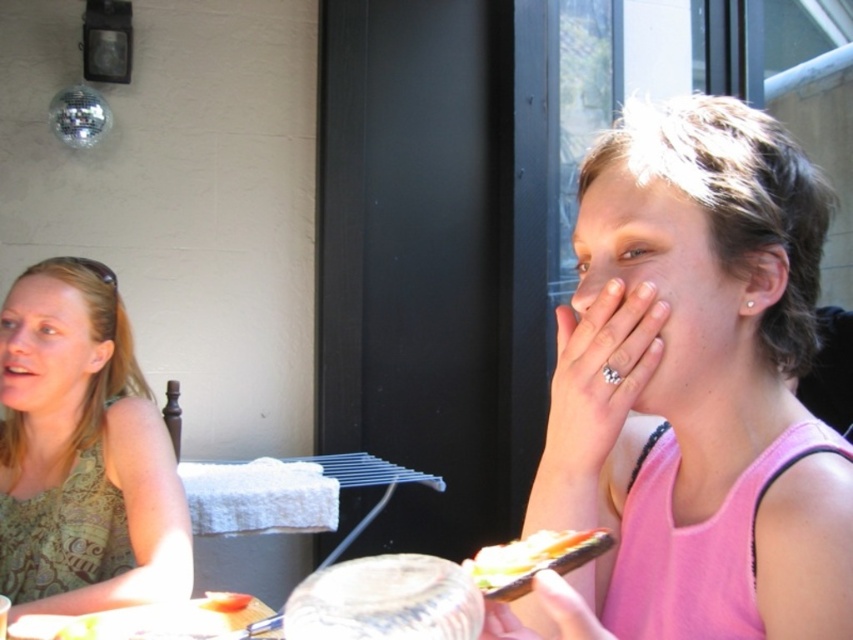
Is pink fabric tank top at right positioned behind green patterned tank top at left?

No, pink fabric tank top at right is closer to the viewer.

Who is taller, pink fabric tank top at right or green patterned tank top at left?

With more height is green patterned tank top at left.

What are the coordinates of `pink fabric tank top at right` in the screenshot? It's located at (693, 390).

Which is above, shiny plastic sandwich at lower center or smooth white bread at lower center?

shiny plastic sandwich at lower center is higher up.

Is shiny plastic sandwich at lower center taller than smooth white bread at lower center?

In fact, shiny plastic sandwich at lower center may be shorter than smooth white bread at lower center.

Is point (483, 586) farther from camera compared to point (233, 595)?

No, it is in front of (233, 595).

The width and height of the screenshot is (853, 640). In order to click on shiny plastic sandwich at lower center in this screenshot , I will do `click(532, 560)`.

Is point (135, 582) behind point (212, 602)?

Yes, point (135, 582) is behind point (212, 602).

The width and height of the screenshot is (853, 640). What do you see at coordinates (82, 451) in the screenshot?
I see `green patterned tank top at left` at bounding box center [82, 451].

Locate an element on the screen. This screenshot has height=640, width=853. green patterned tank top at left is located at coordinates [x=82, y=451].